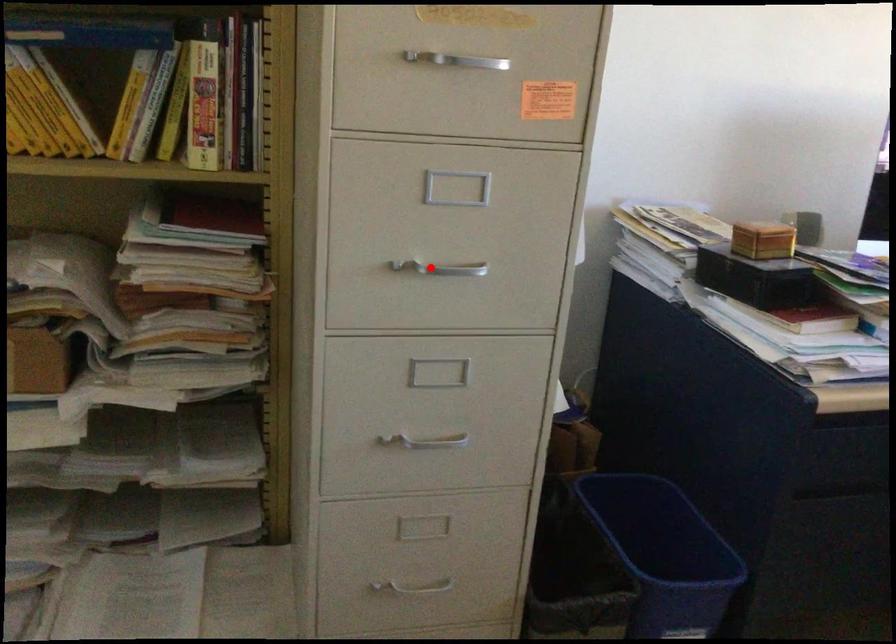
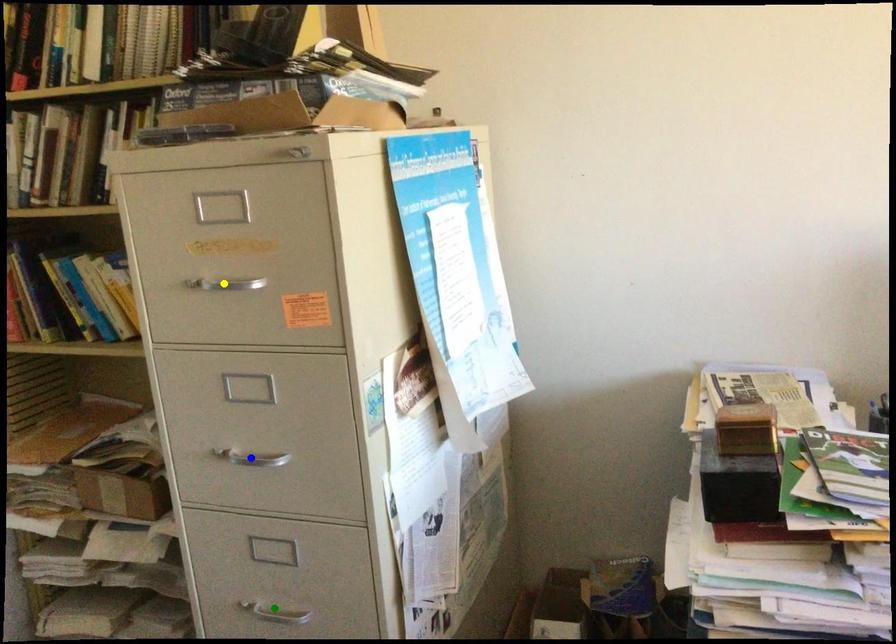
Question: I am providing you with two images of the same scene from different viewpoints. A red point is marked on the first image. You are given multiple points on the second image. Which mark in image 2 goes with the point in image 1?

Choices:
 (A) yellow point
 (B) blue point
 (C) green point

Answer: (B)